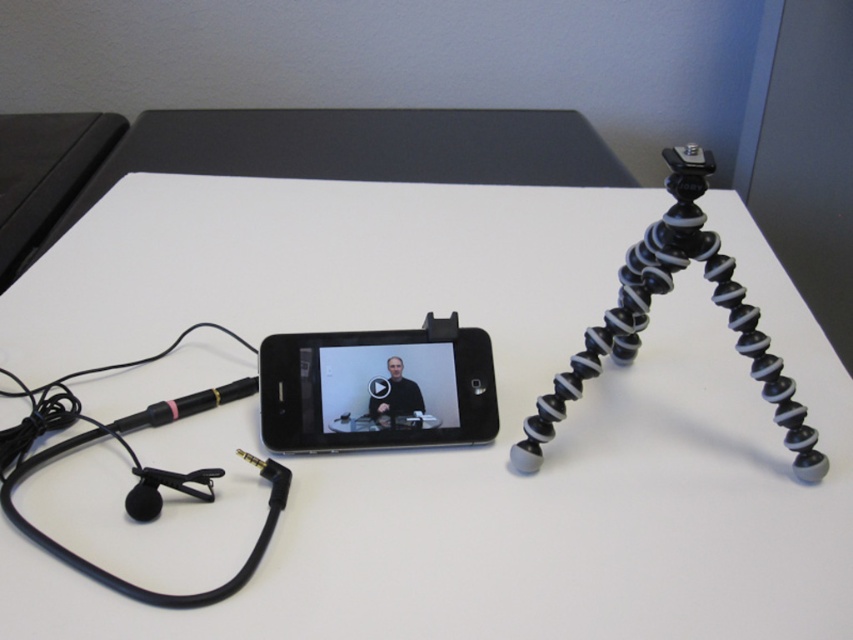
Question: Which of these objects is positioned closest to the black rubberized tripod at right?

Choices:
 (A) black matte smartphone at center
 (B) black matte video player at center

Answer: (A)

Question: Is black matte smartphone at center thinner than black matte video player at center?

Choices:
 (A) no
 (B) yes

Answer: (A)

Question: Is black matte smartphone at center wider than black rubberized tripod at right?

Choices:
 (A) yes
 (B) no

Answer: (B)

Question: Can you confirm if black matte smartphone at center is positioned to the left of black matte video player at center?

Choices:
 (A) yes
 (B) no

Answer: (A)

Question: Which of these objects is positioned farthest from the black matte smartphone at center?

Choices:
 (A) black matte video player at center
 (B) black rubberized tripod at right

Answer: (B)

Question: Which of the following is the closest to the observer?

Choices:
 (A) (698, 179)
 (B) (497, 408)

Answer: (A)